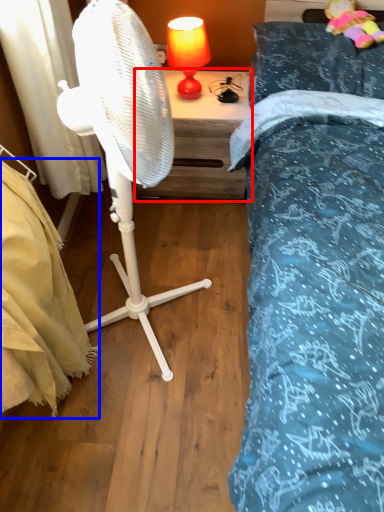
Question: Among these objects, which one is nearest to the camera, nightstand (highlighted by a red box) or mattress (highlighted by a blue box)?

Choices:
 (A) nightstand
 (B) mattress

Answer: (B)